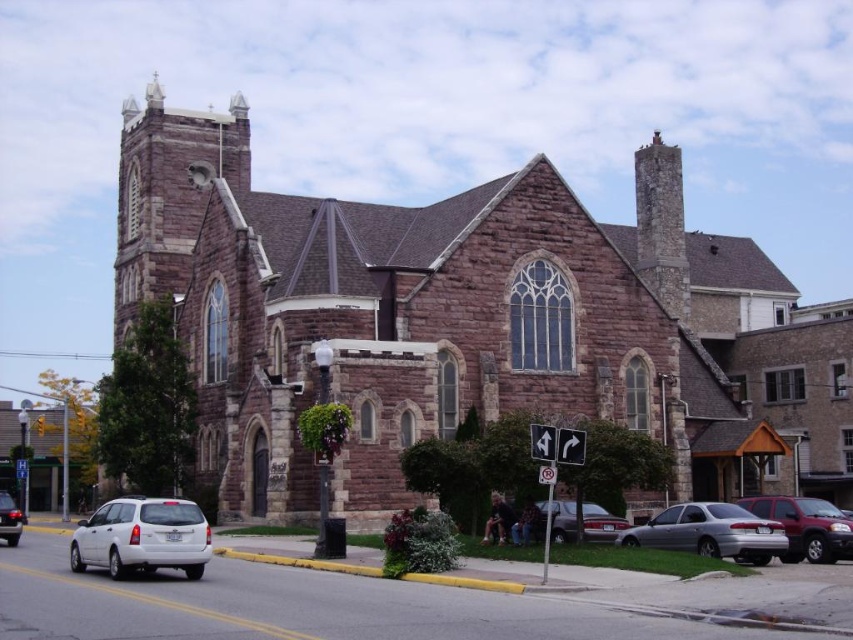
Does silver metallic sedan at lower right come in front of matte silver sedan at lower right?

Yes, silver metallic sedan at lower right is in front of matte silver sedan at lower right.

Locate an element on the screen. The width and height of the screenshot is (853, 640). silver metallic sedan at lower right is located at coordinates (711, 532).

I want to click on silver metallic sedan at lower right, so click(711, 532).

Can you confirm if silver metallic sedan at lower right is taller than matte red suv at lower right?

Yes.

Is silver metallic sedan at lower right behind matte red suv at lower right?

No, silver metallic sedan at lower right is closer to the viewer.

Is point (758, 541) in front of point (776, 518)?

Yes, it is in front of point (776, 518).

Identify the location of silver metallic sedan at lower right. (711, 532).

Does matte red suv at lower right have a smaller size compared to matte silver sedan at lower right?

Incorrect, matte red suv at lower right is not smaller in size than matte silver sedan at lower right.

Between point (851, 520) and point (564, 502), which one is positioned behind?

The point (564, 502) is behind.

The image size is (853, 640). Describe the element at coordinates (805, 525) in the screenshot. I see `matte red suv at lower right` at that location.

Find the location of a particular element. Image resolution: width=853 pixels, height=640 pixels. matte red suv at lower right is located at coordinates (805, 525).